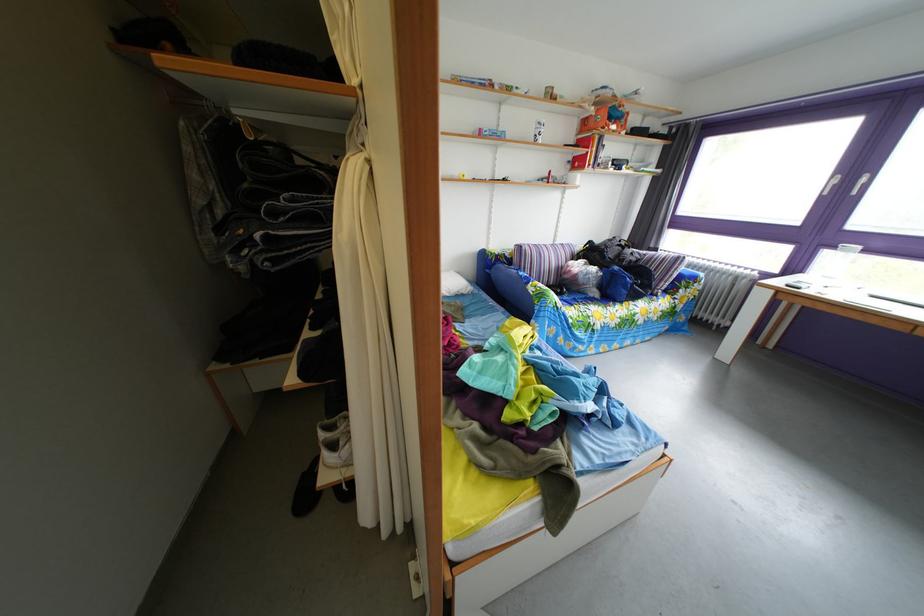
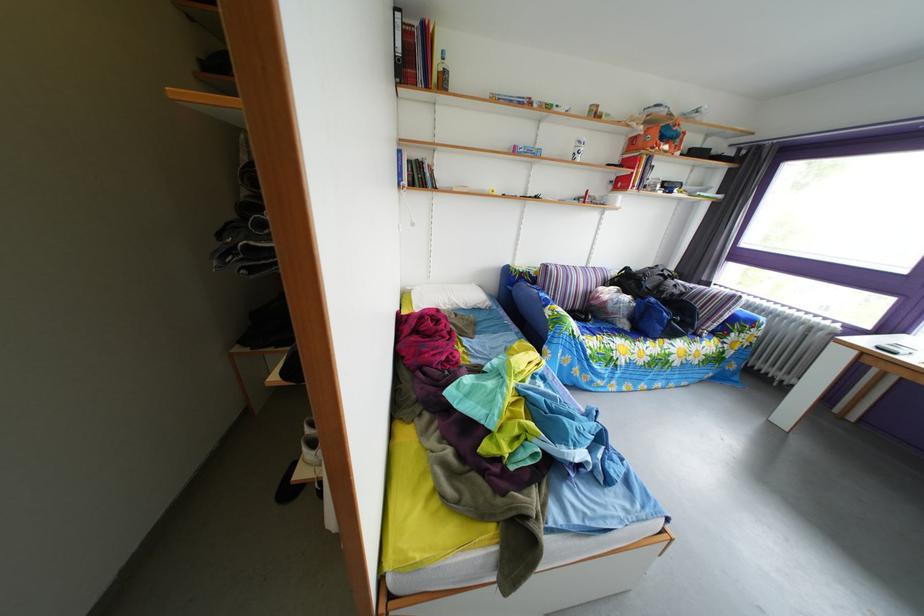
Locate, in the second image, the point that corresponds to point 602,262 in the first image.

(638, 289)